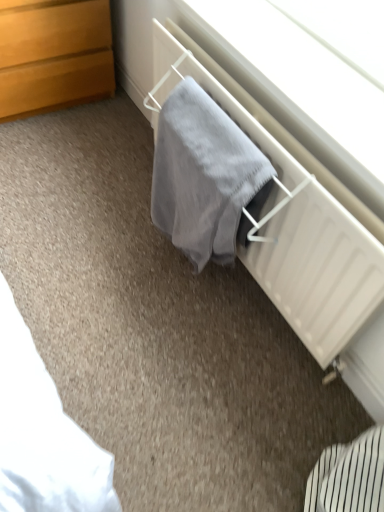
Question: From a real-world perspective, does gray soft towel at center sit lower than wooden chest of drawers at upper left?

Choices:
 (A) yes
 (B) no

Answer: (B)

Question: Is gray soft towel at center facing towards wooden chest of drawers at upper left?

Choices:
 (A) yes
 (B) no

Answer: (B)

Question: From a real-world perspective, is gray soft towel at center positioned over wooden chest of drawers at upper left based on gravity?

Choices:
 (A) no
 (B) yes

Answer: (B)

Question: Does gray soft towel at center lie behind wooden chest of drawers at upper left?

Choices:
 (A) yes
 (B) no

Answer: (B)

Question: Is gray soft towel at center at the left side of wooden chest of drawers at upper left?

Choices:
 (A) yes
 (B) no

Answer: (B)

Question: Is gray soft towel at center positioned in front of wooden chest of drawers at upper left?

Choices:
 (A) no
 (B) yes

Answer: (B)

Question: Can you confirm if wooden chest of drawers at upper left is wider than gray fabric at center?

Choices:
 (A) no
 (B) yes

Answer: (B)

Question: From a real-world perspective, is wooden chest of drawers at upper left beneath gray fabric at center?

Choices:
 (A) yes
 (B) no

Answer: (A)

Question: Is wooden chest of drawers at upper left oriented towards gray fabric at center?

Choices:
 (A) no
 (B) yes

Answer: (B)

Question: Is wooden chest of drawers at upper left outside of gray fabric at center?

Choices:
 (A) yes
 (B) no

Answer: (A)

Question: Considering the relative positions of wooden chest of drawers at upper left and gray fabric at center in the image provided, is wooden chest of drawers at upper left to the left of gray fabric at center from the viewer's perspective?

Choices:
 (A) no
 (B) yes

Answer: (B)

Question: Considering the relative positions of wooden chest of drawers at upper left and gray fabric at center in the image provided, is wooden chest of drawers at upper left behind gray fabric at center?

Choices:
 (A) no
 (B) yes

Answer: (B)

Question: Does gray fabric at center have a greater width compared to wooden chest of drawers at upper left?

Choices:
 (A) no
 (B) yes

Answer: (A)